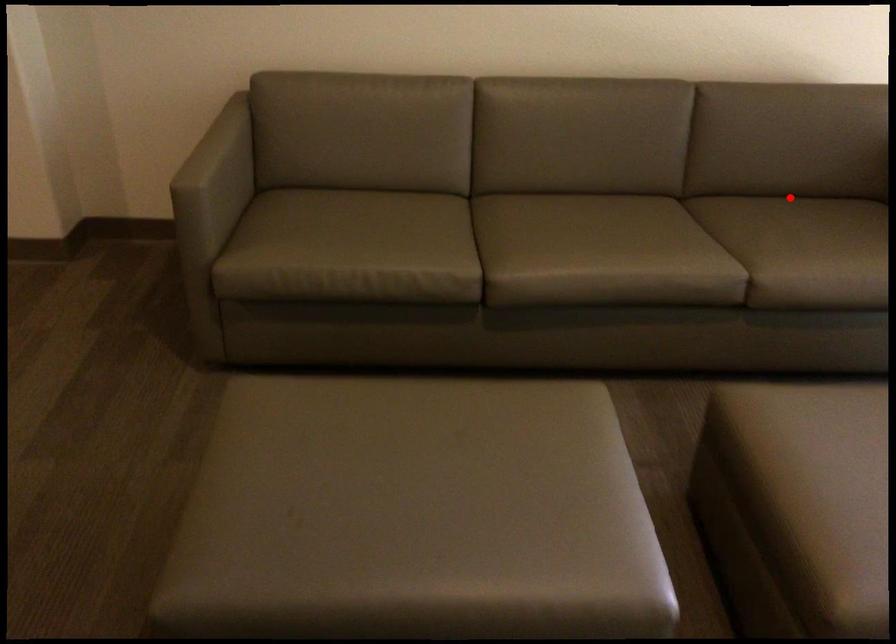
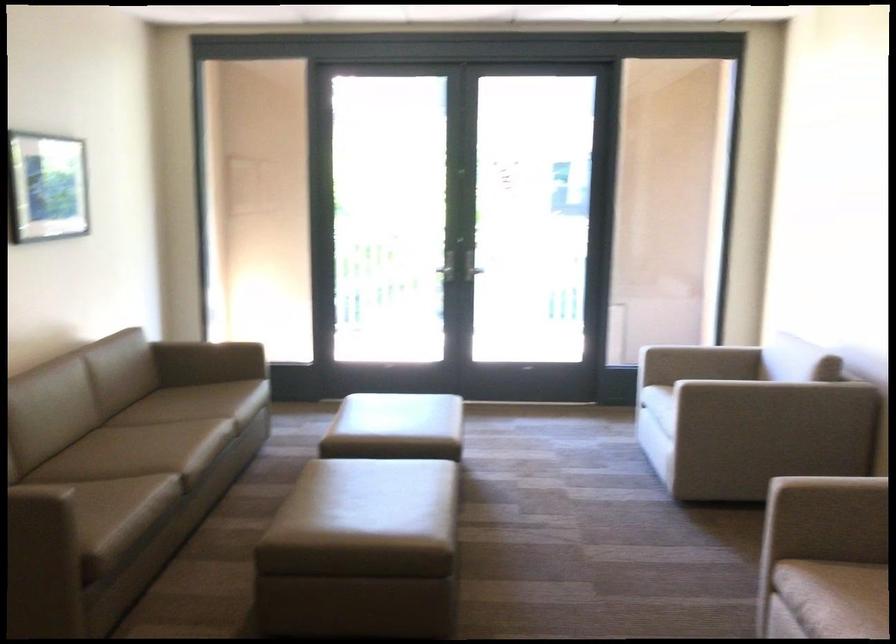
Question: I am providing you with two images of the same scene from different viewpoints. In image1, a red point is highlighted. Considering the same 3D point in image2, which of the following is correct?

Choices:
 (A) It is closer
 (B) It is farther

Answer: (B)